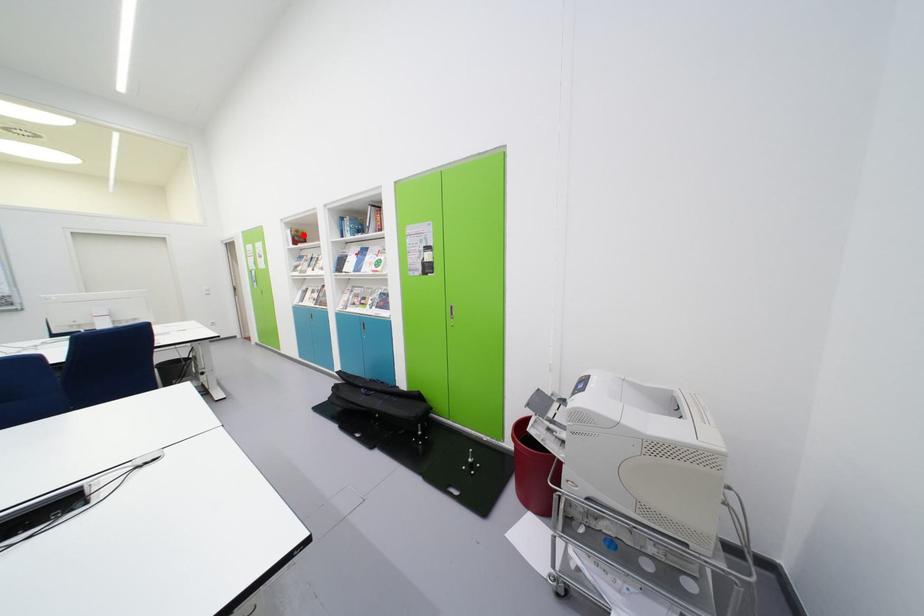
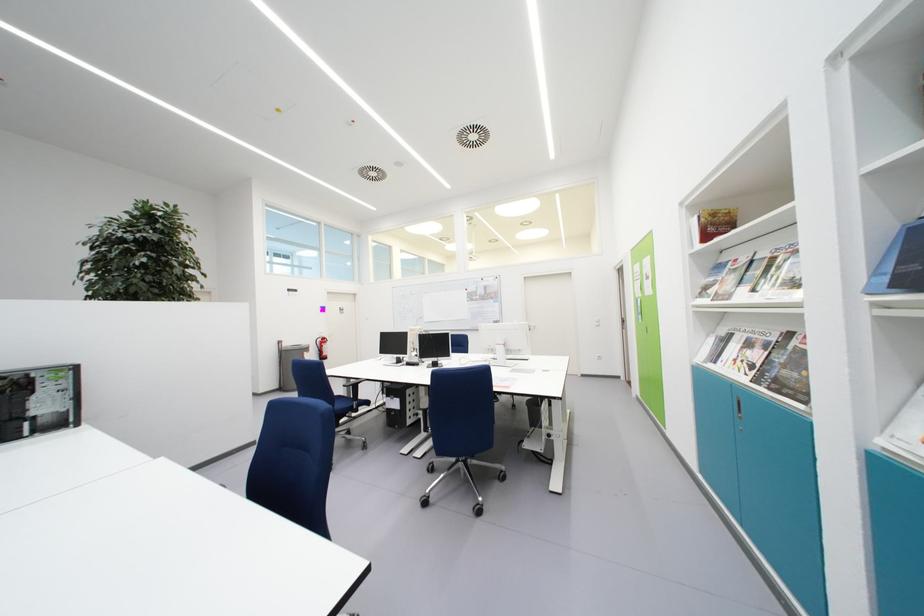
Find the pixel in the second image that matches the highlighted location in the first image.

(720, 217)